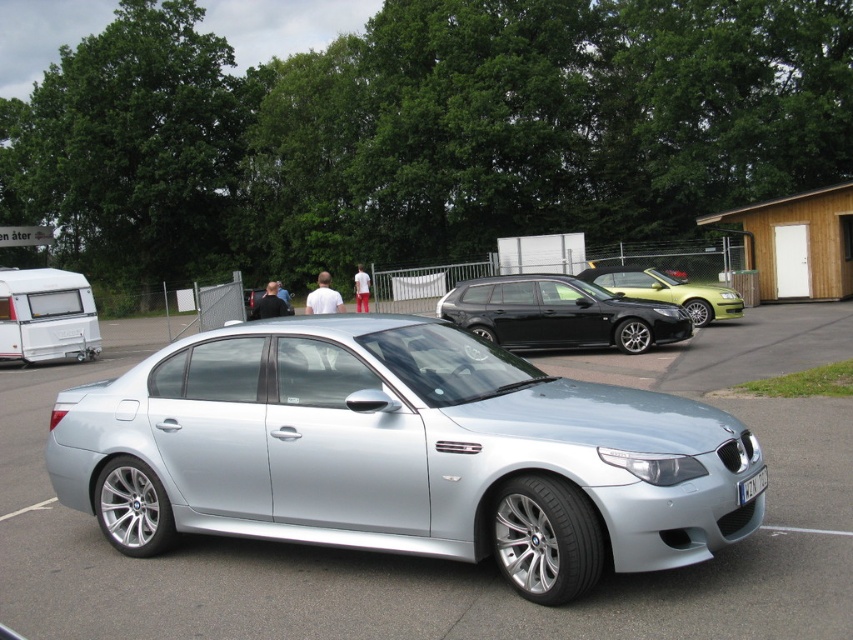
Question: Does black metallic station wagon at center have a lesser width compared to metallic green car at center?

Choices:
 (A) no
 (B) yes

Answer: (A)

Question: Which object is the farthest from the metallic green car at center?

Choices:
 (A) satin silver car at center
 (B) black metallic station wagon at center
 (C) white plastic license plate at center

Answer: (C)

Question: Based on their relative distances, which object is nearer to the black metallic station wagon at center?

Choices:
 (A) metallic green car at center
 (B) white matte camper at left
 (C) white plastic license plate at center
 (D) satin silver car at center

Answer: (A)

Question: Which object is positioned closest to the metallic green car at center?

Choices:
 (A) black metallic station wagon at center
 (B) white matte camper at left
 (C) white plastic license plate at center
 (D) satin silver car at center

Answer: (A)

Question: Is black metallic station wagon at center smaller than white plastic license plate at center?

Choices:
 (A) no
 (B) yes

Answer: (A)

Question: Considering the relative positions of satin silver car at center and white matte camper at left in the image provided, where is satin silver car at center located with respect to white matte camper at left?

Choices:
 (A) right
 (B) left

Answer: (A)